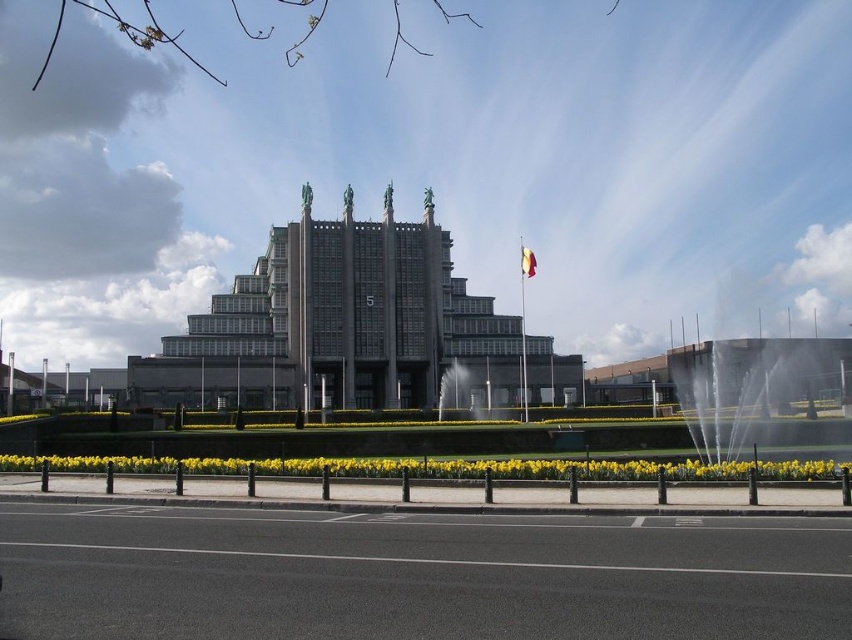
Question: Is white water at right thinner than yellow matte daffodil at lower center?

Choices:
 (A) no
 (B) yes

Answer: (B)

Question: Does white water at right come behind yellow fabric flag at center?

Choices:
 (A) no
 (B) yes

Answer: (A)

Question: Which object is the farthest from the white water at right?

Choices:
 (A) yellow fabric flag at center
 (B) clear glass water at center

Answer: (B)

Question: Where is white water at right located in relation to yellow matte daffodil at lower center in the image?

Choices:
 (A) left
 (B) right

Answer: (B)

Question: Which is nearer to the clear glass water at center?

Choices:
 (A) white water at right
 (B) yellow fabric flag at center
 (C) yellow matte daffodil at lower center

Answer: (B)

Question: Among these points, which one is farthest from the camera?

Choices:
 (A) (531, 273)
 (B) (465, 380)
 (C) (448, 468)
 (D) (737, 397)

Answer: (B)